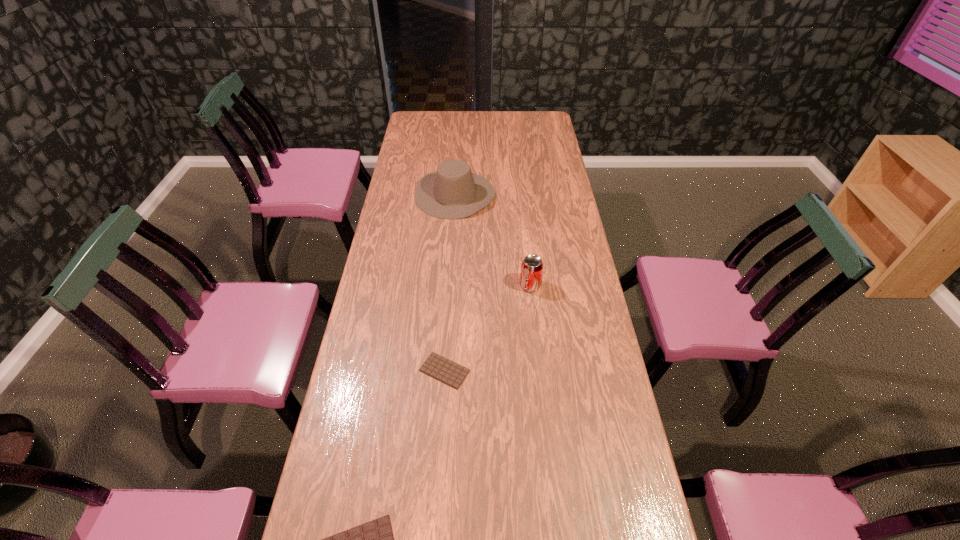
Identify the location of cowboy hat. (453, 192).

Identify the location of the rightmost object. (532, 266).

Find the location of `soda can`. soda can is located at coordinates (532, 266).

Locate an element on the screen. The width and height of the screenshot is (960, 540). the taller chocolate bar is located at coordinates (436, 366).

The height and width of the screenshot is (540, 960). Identify the location of the right chocolate bar. (436, 366).

Find the location of `vacant space located 0.240m on the front of the cowboy hat`. vacant space located 0.240m on the front of the cowboy hat is located at coordinates (450, 260).

Image resolution: width=960 pixels, height=540 pixels. Find the location of `free region located on the left of the third nearest object`. free region located on the left of the third nearest object is located at coordinates (494, 286).

Locate an element on the screen. vacant region located 0.390m on the back of the farther chocolate bar is located at coordinates tap(451, 265).

You are a GUI agent. You are given a task and a screenshot of the screen. Output one action in this format:
    pyautogui.click(x=<x>, y=<y>)
    Task: Click on the object that is at the left edge
    
    Given the screenshot: What is the action you would take?
    pyautogui.click(x=453, y=192)

The width and height of the screenshot is (960, 540). Find the location of `blank space at the far edge`. blank space at the far edge is located at coordinates (451, 113).